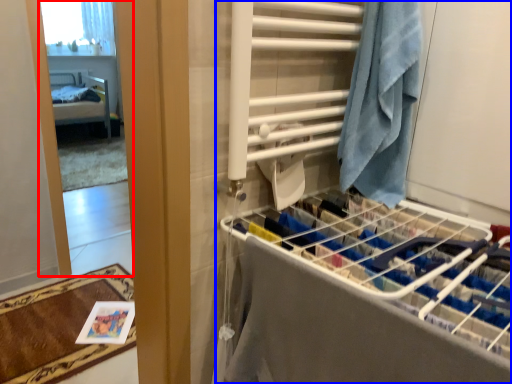
Question: Which object appears farthest to the camera in this image, mirror (highlighted by a red box) or closet (highlighted by a blue box)?

Choices:
 (A) mirror
 (B) closet

Answer: (A)